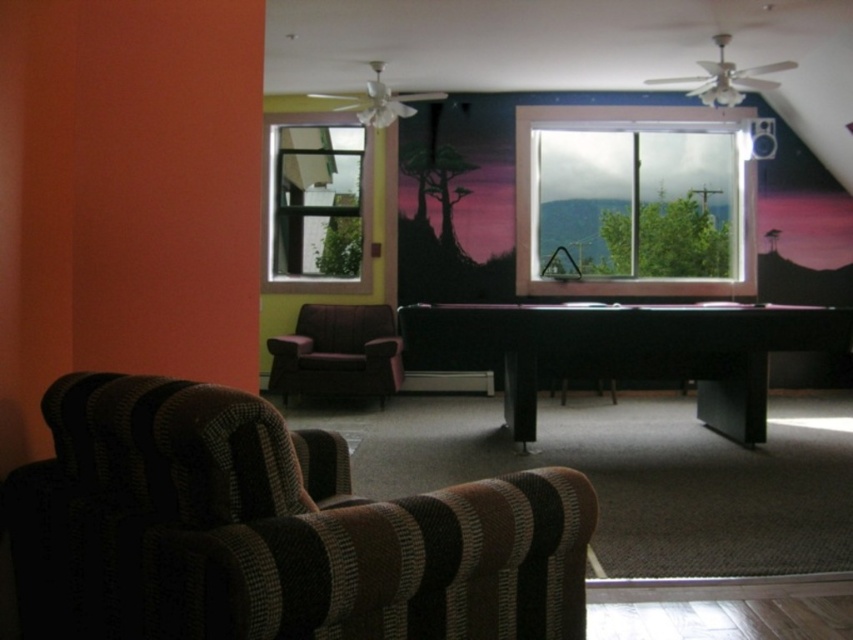
Does point (526, 132) come closer to viewer compared to point (329, 369)?

No, (526, 132) is further to viewer.

Is clear glass window at center smaller than matte purple armchair at center?

Yes.

Is point (527, 220) positioned after point (267, 348)?

Yes, point (527, 220) is farther from viewer.

Image resolution: width=853 pixels, height=640 pixels. Identify the location of clear glass window at center. (636, 129).

Is clear glass window at center behind dark brown leather armchair at center?

That is True.

Between clear glass window at center and dark brown leather armchair at center, which one appears on the right side from the viewer's perspective?

clear glass window at center

What do you see at coordinates (636, 129) in the screenshot?
I see `clear glass window at center` at bounding box center [636, 129].

Where is `clear glass window at center`? This screenshot has height=640, width=853. clear glass window at center is located at coordinates (636, 129).

Is matte purple armchair at center to the right of dark brown leather armchair at center from the viewer's perspective?

No, matte purple armchair at center is not to the right of dark brown leather armchair at center.

Is matte purple armchair at center thinner than dark brown leather armchair at center?

No.

Is point (355, 328) in front of point (561, 397)?

That is False.

At what (x,y) coordinates should I click in order to perform the action: click on matte purple armchair at center. Please return your answer as a coordinate pair (x, y). Image resolution: width=853 pixels, height=640 pixels. Looking at the image, I should click on (338, 353).